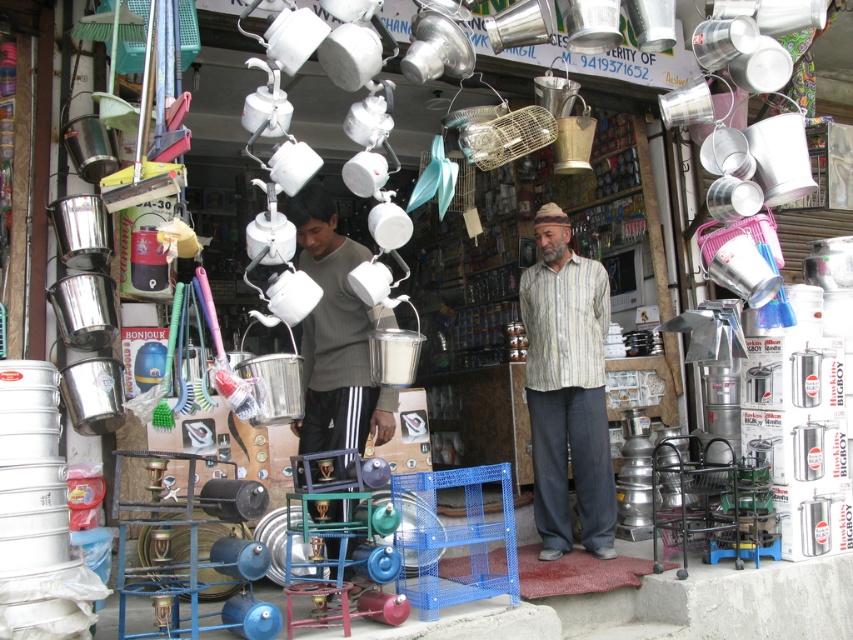
Is striped cotton shirt at center to the left of gray sweater at center from the viewer's perspective?

In fact, striped cotton shirt at center is to the right of gray sweater at center.

Which is behind, point (538, 273) or point (310, 256)?

The point (538, 273) is behind.

Between point (585, 356) and point (318, 365), which one is positioned in front?

Point (318, 365)

I want to click on striped cotton shirt at center, so click(566, 388).